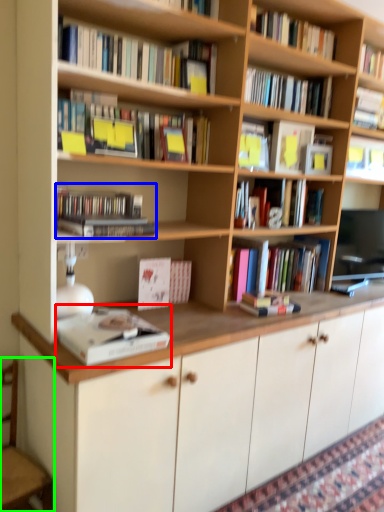
Question: Considering the real-world distances, which object is closest to book (highlighted by a red box)? book (highlighted by a blue box) or armchair (highlighted by a green box).

Choices:
 (A) book
 (B) armchair

Answer: (A)